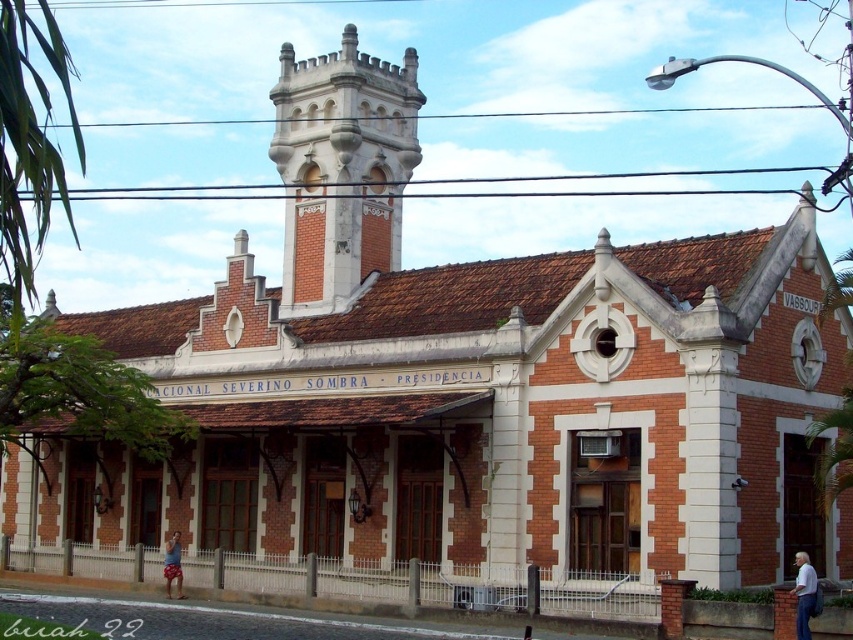
Between white cotton shirt at lower right and beige shorts at lower left, which one has more height?

beige shorts at lower left

In the scene shown: Is white cotton shirt at lower right bigger than beige shorts at lower left?

Correct, white cotton shirt at lower right is larger in size than beige shorts at lower left.

The image size is (853, 640). What are the coordinates of `white cotton shirt at lower right` in the screenshot? It's located at (804, 593).

Is red brick bell tower at upper center smaller than beige shorts at lower left?

No.

Which is below, red brick bell tower at upper center or beige shorts at lower left?

beige shorts at lower left

The width and height of the screenshot is (853, 640). What do you see at coordinates (341, 170) in the screenshot? I see `red brick bell tower at upper center` at bounding box center [341, 170].

Locate an element on the screen. This screenshot has width=853, height=640. red brick bell tower at upper center is located at coordinates (341, 170).

Can you confirm if red brick bell tower at upper center is thinner than white cotton shirt at lower right?

Incorrect, red brick bell tower at upper center's width is not less than white cotton shirt at lower right's.

Does red brick bell tower at upper center have a lesser height compared to white cotton shirt at lower right?

No.

Does point (367, 99) come farther from viewer compared to point (796, 552)?

Yes, it is behind point (796, 552).

Find the location of `red brick bell tower at upper center`. red brick bell tower at upper center is located at coordinates (341, 170).